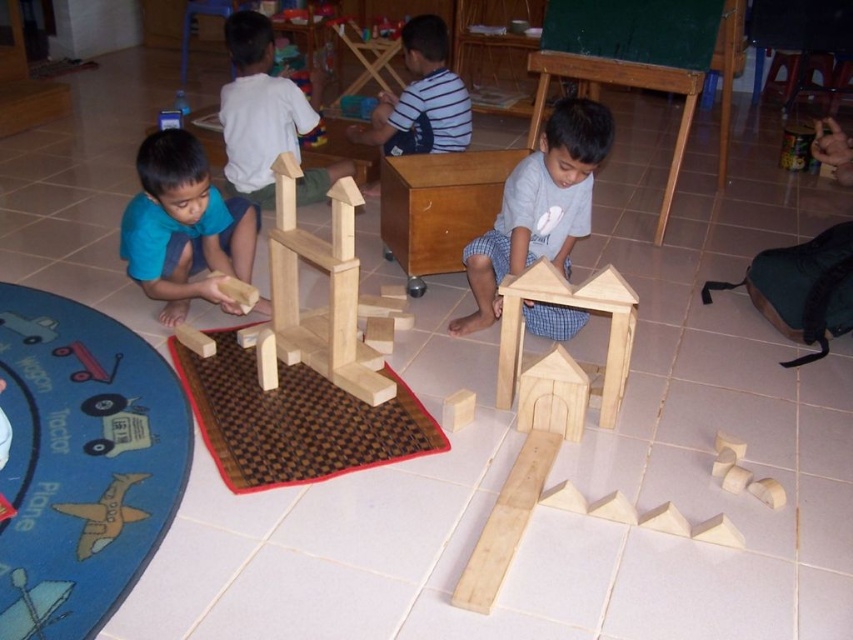
Question: Which object appears closest to the camera in this image?

Choices:
 (A) blue matte shirt at lower left
 (B) white matte shirt at upper center

Answer: (A)

Question: In this image, where is natural wood tower at center located relative to wooden tractor at lower left?

Choices:
 (A) right
 (B) left

Answer: (A)

Question: Does brown woven mat at center appear on the right side of natural wood tower at center?

Choices:
 (A) yes
 (B) no

Answer: (B)

Question: Considering the real-world distances, which object is farthest from the matte light brown wooden block at center?

Choices:
 (A) wooden house at lower center
 (B) blue fabric mat at lower left
 (C) white matte shirt at upper center

Answer: (C)

Question: Which of the following is the farthest from the observer?

Choices:
 (A) (105, 404)
 (B) (119, 356)

Answer: (B)

Question: Does natural wood tower at center appear over wooden house at lower center?

Choices:
 (A) yes
 (B) no

Answer: (A)